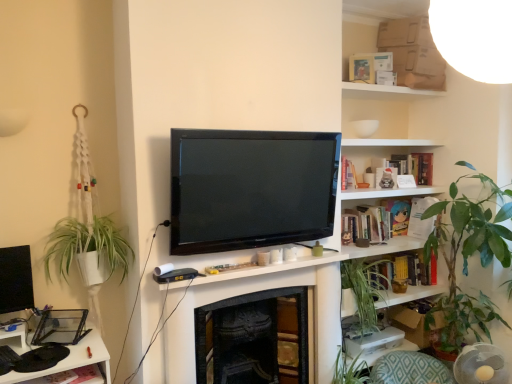
Question: Is green fabric cushion at lower right to the left of wooden bookshelf at upper right from the viewer's perspective?

Choices:
 (A) no
 (B) yes

Answer: (A)

Question: Can you see green fabric cushion at lower right touching wooden bookshelf at upper right?

Choices:
 (A) yes
 (B) no

Answer: (B)

Question: Is green fabric cushion at lower right smaller than wooden bookshelf at upper right?

Choices:
 (A) yes
 (B) no

Answer: (B)

Question: From a real-world perspective, is green fabric cushion at lower right located beneath wooden bookshelf at upper right?

Choices:
 (A) yes
 (B) no

Answer: (A)

Question: From a real-world perspective, is green fabric cushion at lower right on wooden bookshelf at upper right?

Choices:
 (A) yes
 (B) no

Answer: (B)

Question: Is the depth of green fabric cushion at lower right less than that of wooden bookshelf at upper right?

Choices:
 (A) no
 (B) yes

Answer: (B)

Question: Considering the relative sizes of hardcover book at center-right, placed as the first book when sorted from bottom to top, and green fabric cushion at lower right in the image provided, is hardcover book at center-right, placed as the first book when sorted from bottom to top, wider than green fabric cushion at lower right?

Choices:
 (A) no
 (B) yes

Answer: (A)

Question: Does hardcover book at center-right, placed as the first book when sorted from bottom to top, have a greater height compared to green fabric cushion at lower right?

Choices:
 (A) no
 (B) yes

Answer: (A)

Question: Is hardcover book at center-right, marked as the third book in a top-to-bottom arrangement, oriented away from green fabric cushion at lower right?

Choices:
 (A) yes
 (B) no

Answer: (B)

Question: Are hardcover book at center-right, placed as the first book when sorted from bottom to top, and green fabric cushion at lower right located far from each other?

Choices:
 (A) no
 (B) yes

Answer: (A)

Question: Considering the relative positions of hardcover book at center-right, marked as the third book in a top-to-bottom arrangement, and green fabric cushion at lower right in the image provided, is hardcover book at center-right, marked as the third book in a top-to-bottom arrangement, to the right of green fabric cushion at lower right from the viewer's perspective?

Choices:
 (A) no
 (B) yes

Answer: (A)

Question: Can you confirm if hardcover book at center-right, marked as the third book in a top-to-bottom arrangement, is positioned to the left of green fabric cushion at lower right?

Choices:
 (A) yes
 (B) no

Answer: (A)

Question: Does white cardboard box at upper right appear on the right side of green leafy plant at right?

Choices:
 (A) yes
 (B) no

Answer: (B)